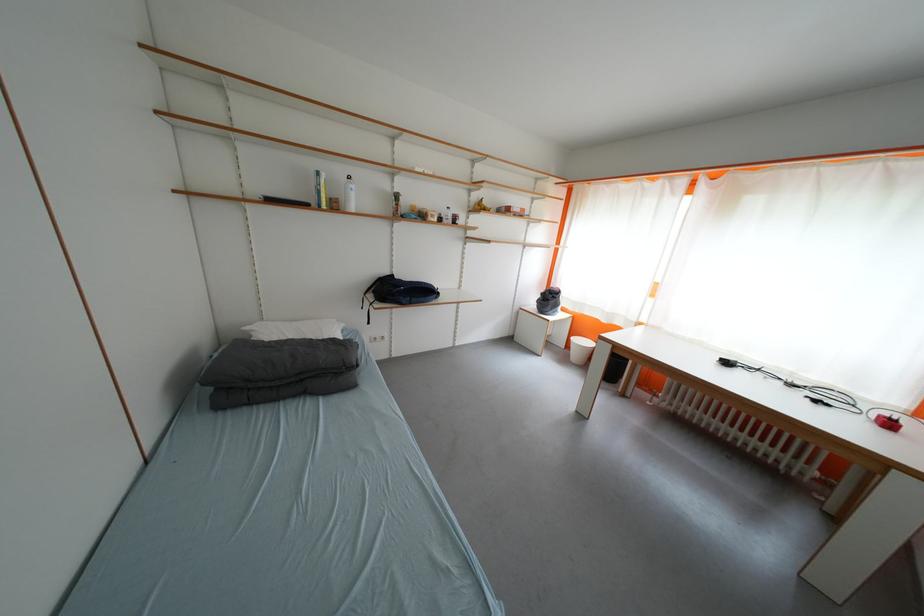
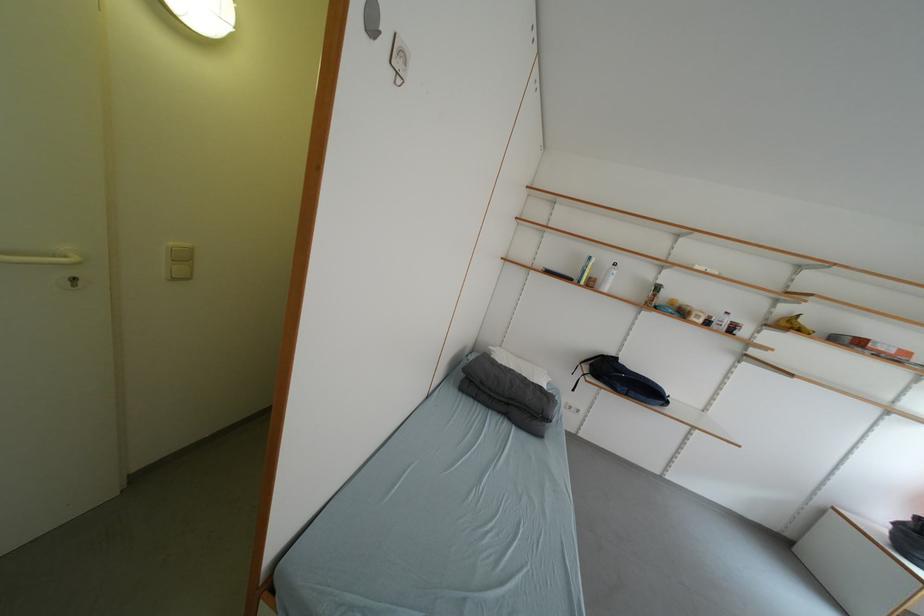
Where in the second image is the point corresponding to point 527,315 from the first image?

(832, 515)